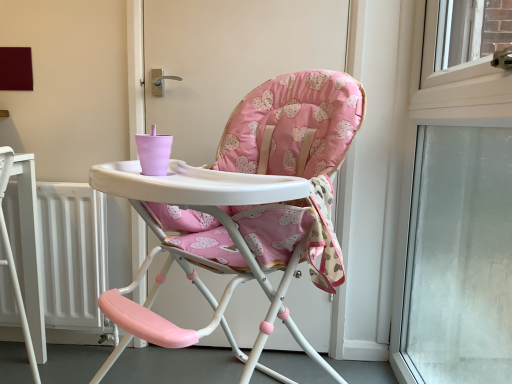
This screenshot has width=512, height=384. I want to click on free space in front of white matte radiator at lower left, so click(54, 368).